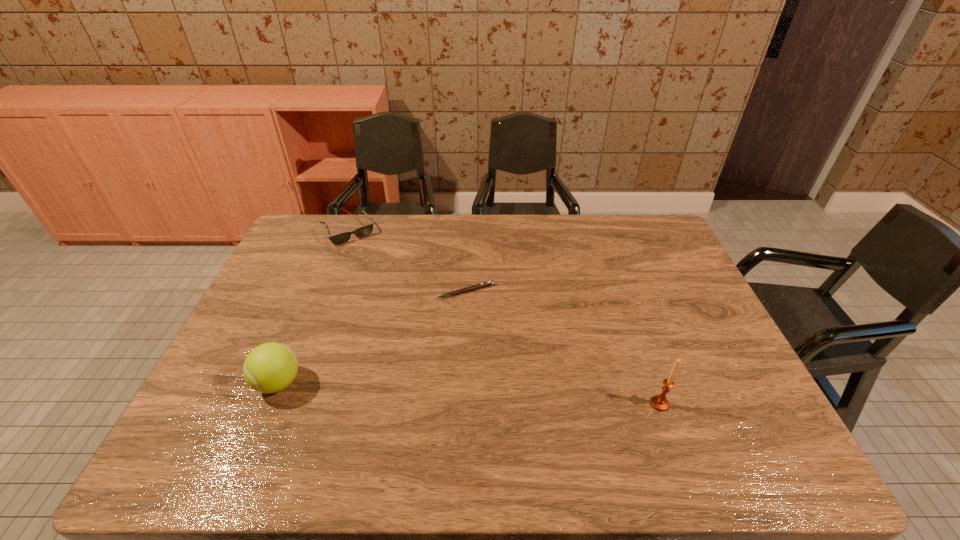
Find the location of `the second tallest object`. the second tallest object is located at coordinates pyautogui.click(x=269, y=368).

You are a GUI agent. You are given a task and a screenshot of the screen. Output one action in this format:
    pyautogui.click(x=<x>, y=<y>)
    Task: Click on the rightmost object
    The width and height of the screenshot is (960, 540).
    Given the screenshot: What is the action you would take?
    pyautogui.click(x=659, y=402)

The height and width of the screenshot is (540, 960). Find the location of `candle_holder`. candle_holder is located at coordinates (659, 402).

Locate an element on the screen. the third nearest object is located at coordinates (478, 286).

The width and height of the screenshot is (960, 540). In order to click on the second object from right to left in this screenshot , I will do `click(478, 286)`.

Locate an element on the screen. The width and height of the screenshot is (960, 540). sunglasses is located at coordinates (363, 231).

At what (x,y) coordinates should I click in order to perform the action: click on the second shortest object. Please return your answer as a coordinate pair (x, y). The image size is (960, 540). Looking at the image, I should click on (363, 231).

Where is `blank space located on the right of the third shortest object`? The image size is (960, 540). blank space located on the right of the third shortest object is located at coordinates (383, 383).

Locate an element on the screen. The height and width of the screenshot is (540, 960). vacant point located on the back of the tallest object is located at coordinates (650, 375).

Image resolution: width=960 pixels, height=540 pixels. I want to click on vacant space located at the nib of the third nearest object, so (423, 416).